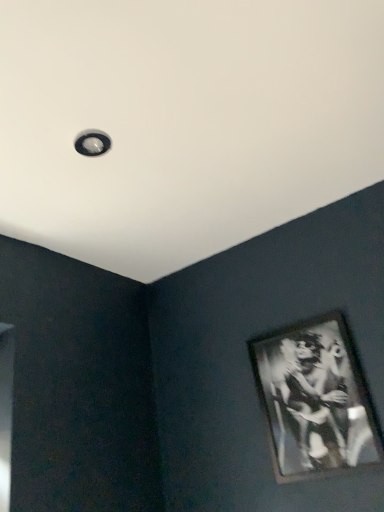
This screenshot has width=384, height=512. I want to click on black glossy picture frame at lower right, so click(x=315, y=399).

What is the approximate height of black glossy picture frame at lower right?

It is 17.23 inches.

This screenshot has width=384, height=512. What do you see at coordinates (315, 399) in the screenshot?
I see `black glossy picture frame at lower right` at bounding box center [315, 399].

Where is `black glossy picture frame at lower right`? black glossy picture frame at lower right is located at coordinates (315, 399).